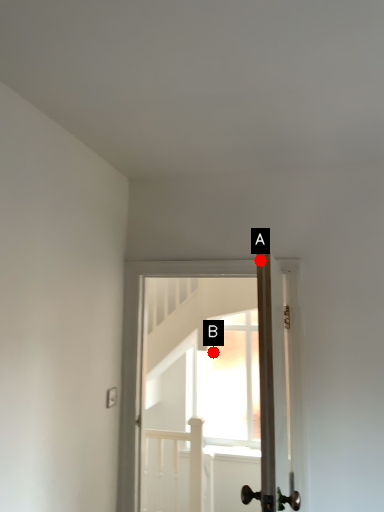
Question: Two points are circled on the image, labeled by A and B beside each circle. Which point is farther to the camera?

Choices:
 (A) A is further
 (B) B is further

Answer: (B)